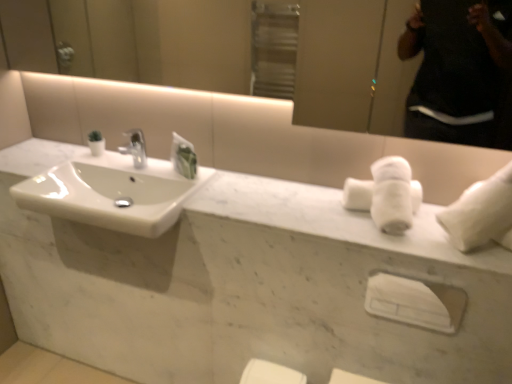
Where is `free spot below white matte towel at right, which is the second bath towel in left-to-right order (from a real-world perspective)`? This screenshot has width=512, height=384. free spot below white matte towel at right, which is the second bath towel in left-to-right order (from a real-world perspective) is located at coordinates (466, 248).